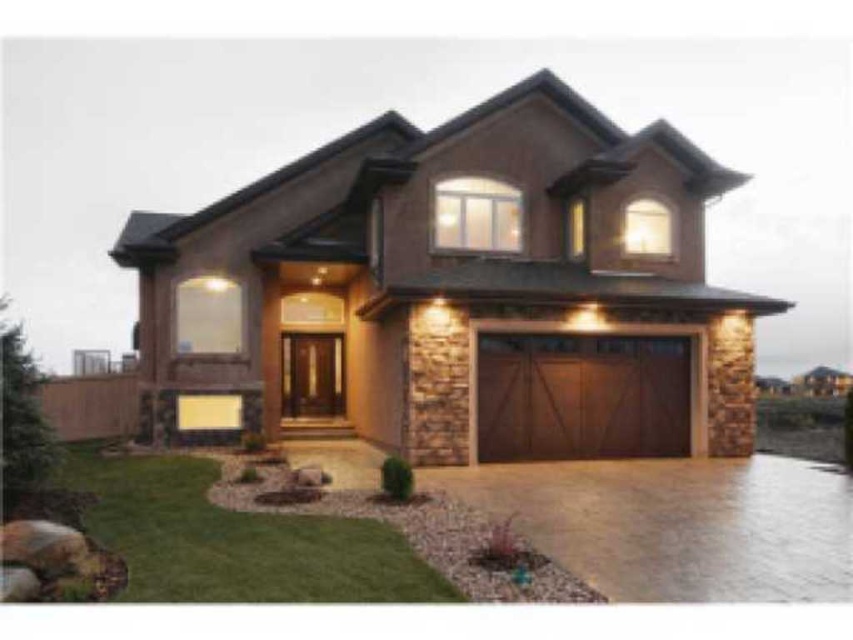
Between brown wood/glass garage at center and wooden at center, which one appears on the left side from the viewer's perspective?

From the viewer's perspective, brown wood/glass garage at center appears more on the left side.

Is point (506, 276) closer to viewer compared to point (598, 380)?

Yes.

Where is `brown wood/glass garage at center`? This screenshot has height=640, width=853. brown wood/glass garage at center is located at coordinates (451, 280).